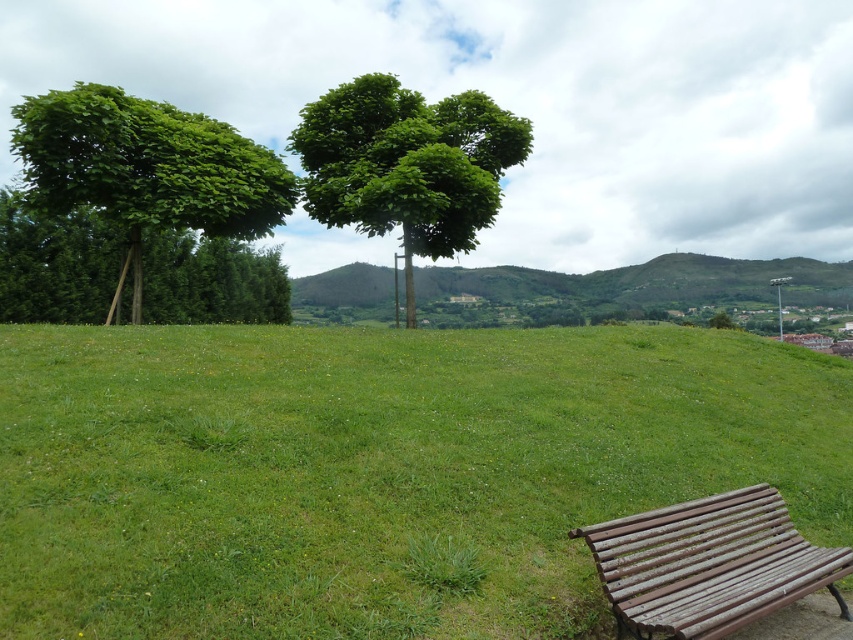
What do you see at coordinates (405, 164) in the screenshot?
I see `green leafy tree at center` at bounding box center [405, 164].

Who is more forward, (x=351, y=140) or (x=131, y=195)?

Point (x=131, y=195)

Is point (491, 116) closer to camera compared to point (22, 150)?

No.

What are the coordinates of `green leafy tree at center` in the screenshot? It's located at (405, 164).

Is green grassy at lower right shorter than green leafy tree at center?

Yes.

Which is more to the right, green grassy at lower right or green leafy tree at center?

From the viewer's perspective, green grassy at lower right appears more on the right side.

The width and height of the screenshot is (853, 640). Find the location of `green grassy at lower right`. green grassy at lower right is located at coordinates (378, 470).

You are a GUI agent. You are given a task and a screenshot of the screen. Output one action in this format:
    pyautogui.click(x=<x>, y=<y>)
    Task: Click on the green grassy at lower right
    The width and height of the screenshot is (853, 640).
    Given the screenshot: What is the action you would take?
    pyautogui.click(x=378, y=470)

Which is more to the right, green grassy at lower right or green grassy hillside at center?

Positioned to the right is green grassy hillside at center.

Who is more forward, (117, 429) or (767, 273)?

Point (117, 429) is in front.

Locate an element on the screen. green grassy at lower right is located at coordinates (378, 470).